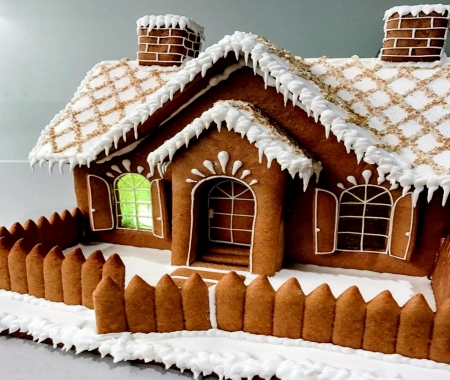
Identify the location of windows. (355, 218), (142, 202).